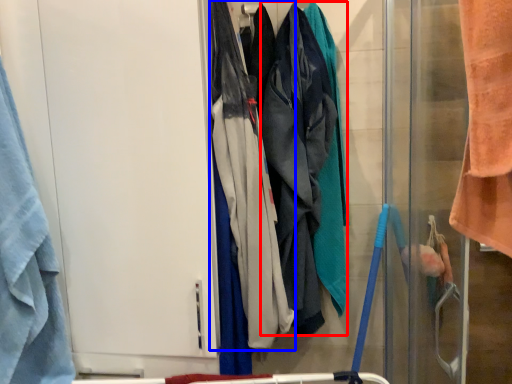
Question: Which object is further to the camera taking this photo, wide (highlighted by a red box) or wide (highlighted by a blue box)?

Choices:
 (A) wide
 (B) wide

Answer: (A)